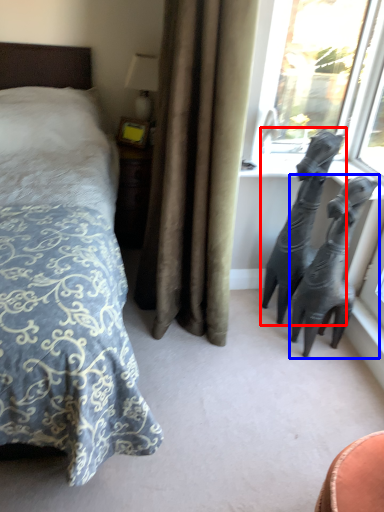
Question: Which of the following is the closest to the observer, animal (highlighted by a red box) or bronze sculpture (highlighted by a blue box)?

Choices:
 (A) animal
 (B) bronze sculpture

Answer: (B)